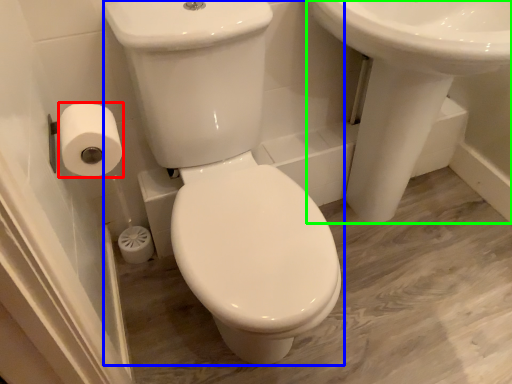
Question: Which object is positioned closest to toilet paper (highlighted by a red box)? Select from porcelain (highlighted by a blue box) and sink (highlighted by a green box).

Choices:
 (A) porcelain
 (B) sink

Answer: (A)